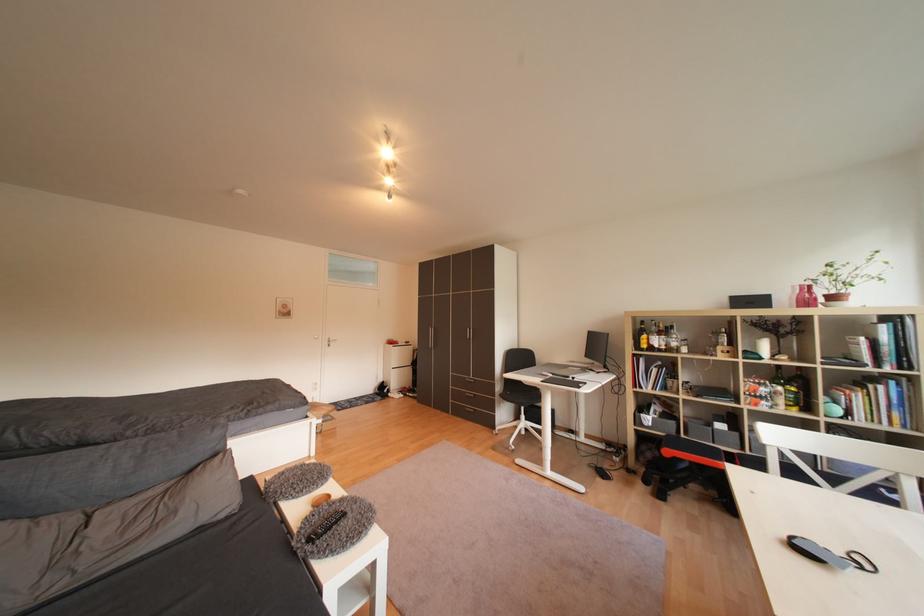
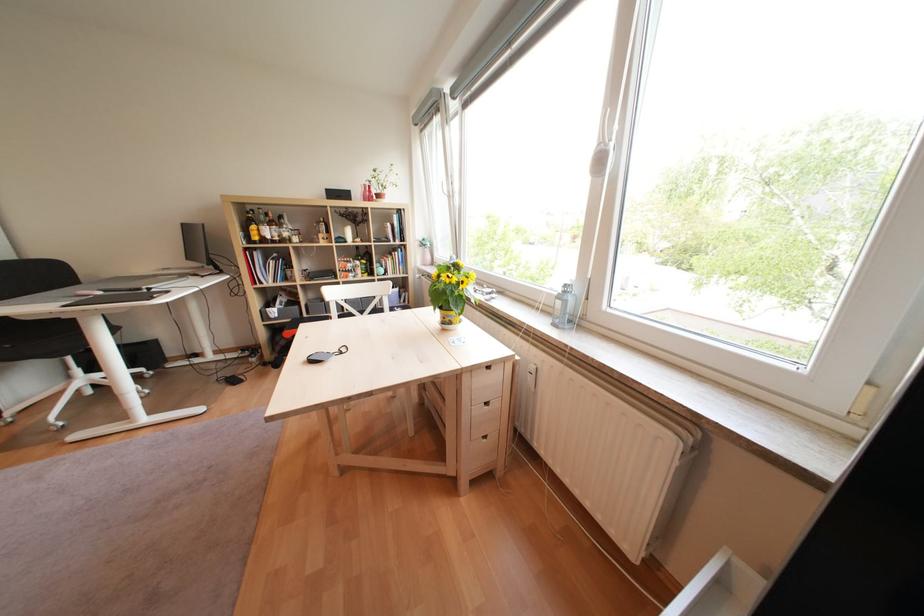
Based on the continuous images, in which direction is the camera rotating?

The camera's rotation is toward right-down.